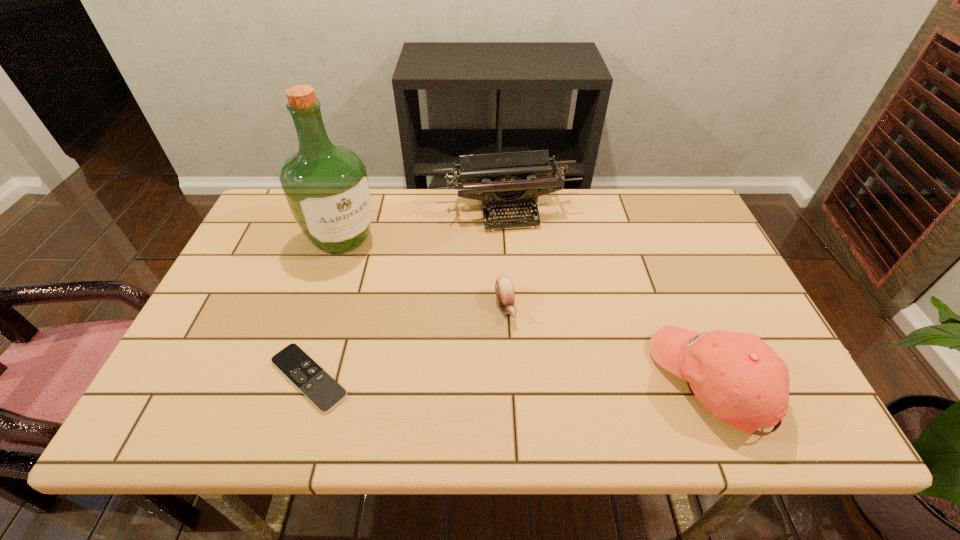
This screenshot has height=540, width=960. In order to click on unoccupied area between the typewriter and the tallest object in this screenshot , I will do `click(424, 224)`.

Find the location of `blank region between the typewriter and the rightmost object`. blank region between the typewriter and the rightmost object is located at coordinates (610, 296).

Identify which object is located as the nearest to the rightmost object. Please provide its 2D coordinates. Your answer should be formatted as a tuple, i.e. [(x, y)], where the tuple contains the x and y coordinates of a point satisfying the conditions above.

[(504, 288)]

Identify the location of the fourth closest object to the liquor. (740, 379).

Identify the location of free region that satisfies the following two spatial constraints: 1. on the back side of the remote control; 2. on the right side of the escargot. (330, 307).

Where is `free space in the image that satisfies the following two spatial constraints: 1. on the front side of the baseball cap; 2. on the front-facing side of the typewriter`? The width and height of the screenshot is (960, 540). free space in the image that satisfies the following two spatial constraints: 1. on the front side of the baseball cap; 2. on the front-facing side of the typewriter is located at coordinates (516, 381).

Where is `vacant area that satisfies the following two spatial constraints: 1. on the front side of the shortest object; 2. on the front-facing side of the rightmost object`? The height and width of the screenshot is (540, 960). vacant area that satisfies the following two spatial constraints: 1. on the front side of the shortest object; 2. on the front-facing side of the rightmost object is located at coordinates (308, 381).

This screenshot has width=960, height=540. I want to click on vacant space that satisfies the following two spatial constraints: 1. on the front side of the third farthest object; 2. on the right side of the liquor, so click(x=320, y=307).